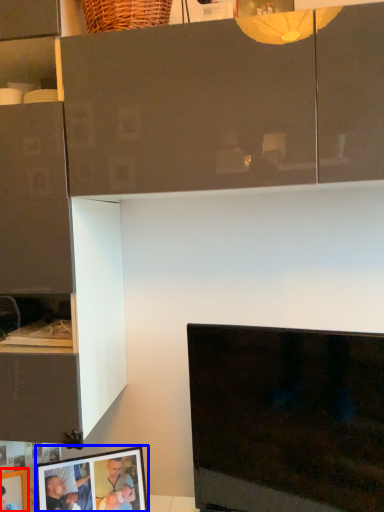
Question: Which object appears farthest to the camera in this image, picture frame (highlighted by a red box) or picture frame (highlighted by a blue box)?

Choices:
 (A) picture frame
 (B) picture frame

Answer: (B)